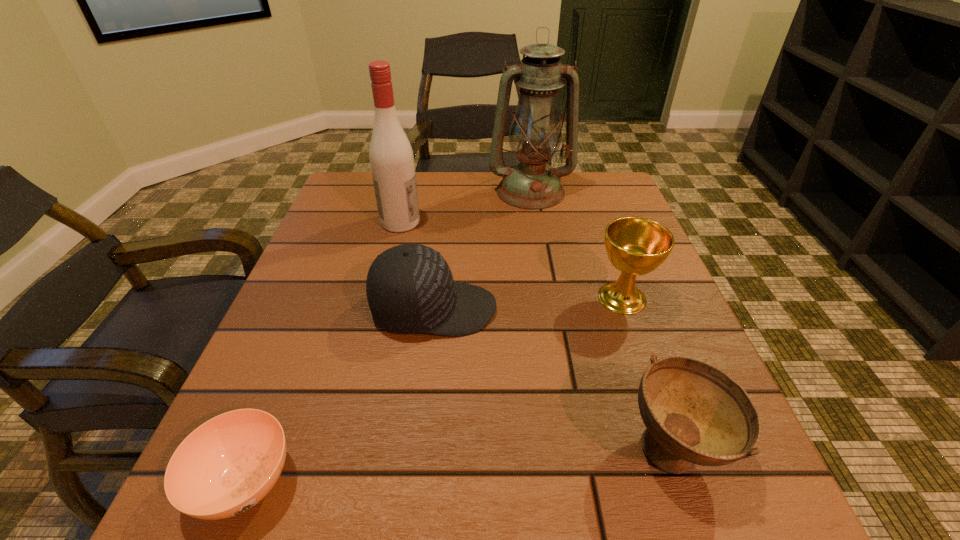
I want to click on oil lamp, so click(x=535, y=134).

Find the location of a particular element. Image resolution: width=960 pixels, height=540 pixels. the fifth nearest object is located at coordinates (391, 157).

You are a GUI agent. You are given a task and a screenshot of the screen. Output one action in this format:
    pyautogui.click(x=<x>, y=<y>)
    Task: Click on the chalice
    
    Given the screenshot: What is the action you would take?
    pyautogui.click(x=635, y=246)

Find the location of a particular element. baseball cap is located at coordinates (410, 289).

At what (x,y) coordinates should I click in order to perform the action: click on the taller soup bowl. Please return your answer as a coordinate pair (x, y). The width and height of the screenshot is (960, 540). Looking at the image, I should click on tap(694, 413).

I want to click on the leftmost object, so click(227, 465).

Locate an element on the screen. This screenshot has height=540, width=960. the shorter soup bowl is located at coordinates (227, 465).

Locate an element on the screen. This screenshot has height=540, width=960. free spot located on the front of the oil lamp is located at coordinates (545, 276).

Locate an element on the screen. The image size is (960, 540). free space located on the label of the second farthest object is located at coordinates (551, 222).

You are a GUI agent. You are given a task and a screenshot of the screen. Output one action in this format:
    pyautogui.click(x=<x>, y=<y>)
    Task: Click on the free spot located on the left of the chalice
    The image size is (960, 540).
    Given the screenshot: What is the action you would take?
    pyautogui.click(x=463, y=298)